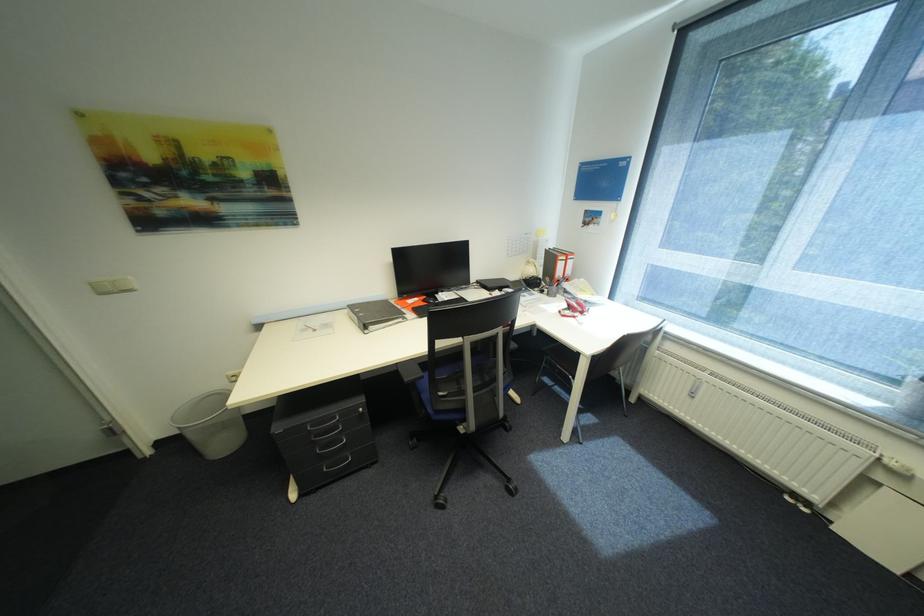
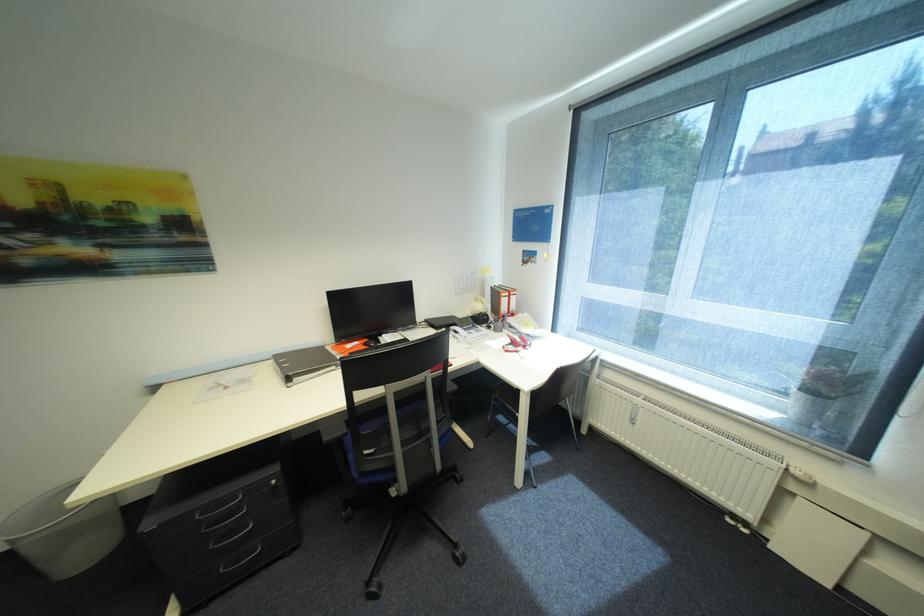
In the second image, find the point that corresponds to the point at 333,469 in the first image.

(229, 570)